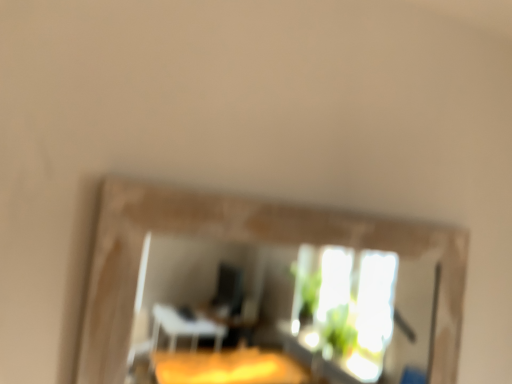
Describe the element at coordinates (243, 241) in the screenshot. I see `wooden mirror at upper center` at that location.

I want to click on wooden mirror at upper center, so click(243, 241).

The image size is (512, 384). I want to click on wooden mirror at upper center, so click(x=243, y=241).